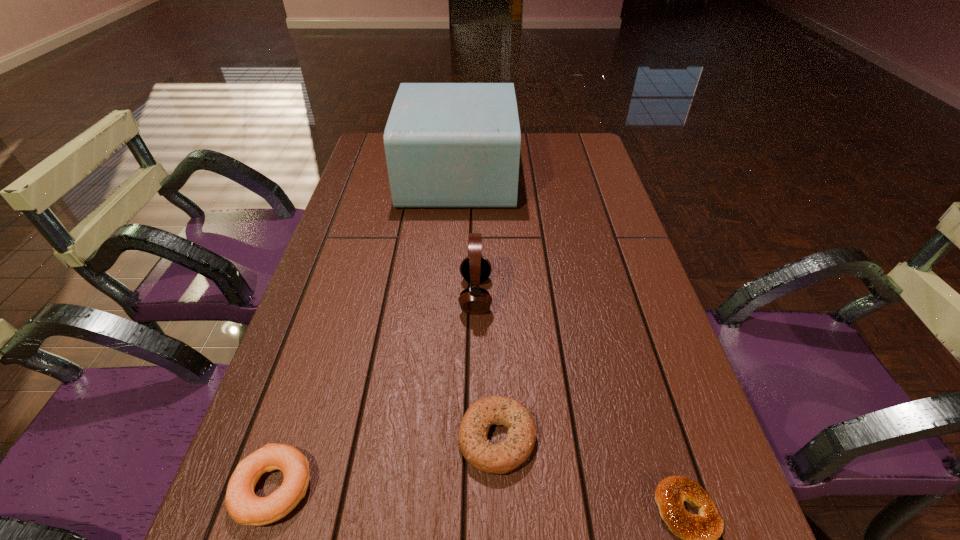
Where is `radio receiver`? radio receiver is located at coordinates (448, 145).

Where is `the farthest object`? the farthest object is located at coordinates (448, 145).

Locate an element on the screen. the fourth nearest object is located at coordinates (475, 268).

The image size is (960, 540). What are the coordinates of `the fourth shortest object` in the screenshot? It's located at (475, 268).

You are a GUI agent. You are given a task and a screenshot of the screen. Output one action in this format:
    pyautogui.click(x=<x>, y=<y>)
    Task: Click on the second bagel from right to left
    This screenshot has width=960, height=540.
    Given the screenshot: What is the action you would take?
    pyautogui.click(x=500, y=458)

You are a GUI agent. You are given a task and a screenshot of the screen. Output one action in this format:
    pyautogui.click(x=<x>, y=<y>)
    Task: Click on the leftmost object
    
    Given the screenshot: What is the action you would take?
    point(244,507)

Identify the location of vacant region located 0.110m on the front panel of the farthest object. This screenshot has height=540, width=960. (549, 176).

The width and height of the screenshot is (960, 540). I want to click on free spot located on the ear pads of the headset, so click(543, 295).

The image size is (960, 540). Identify the location of free spot located 0.130m on the left of the second bagel from right to left. [384, 437].

This screenshot has width=960, height=540. In order to click on vacant space situated on the right of the leftmost object in this screenshot , I will do `click(405, 488)`.